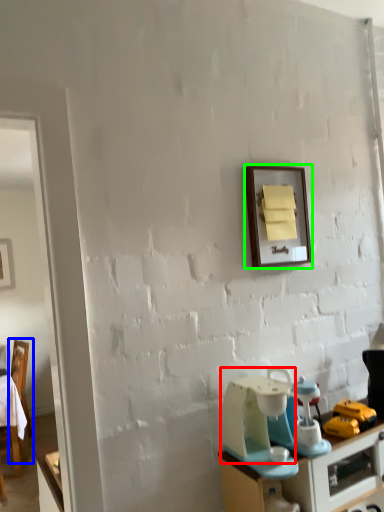
Question: Considering the real-world distances, which object is farthest from appliance (highlighted by a red box)? chair (highlighted by a blue box) or picture frame (highlighted by a green box)?

Choices:
 (A) chair
 (B) picture frame

Answer: (A)